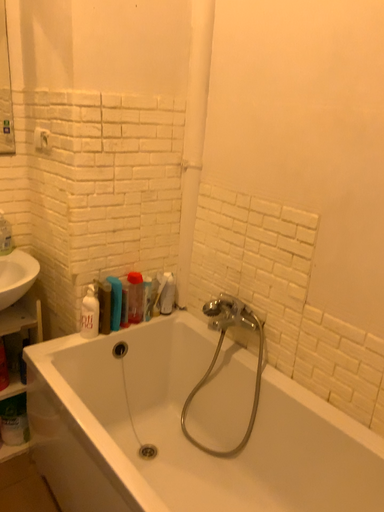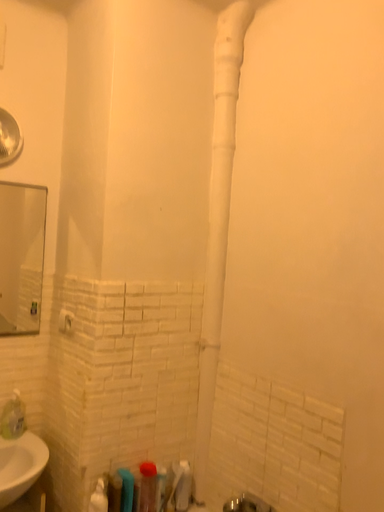
Question: How did the camera likely rotate when shooting the video?

Choices:
 (A) rotated downward
 (B) rotated upward

Answer: (B)